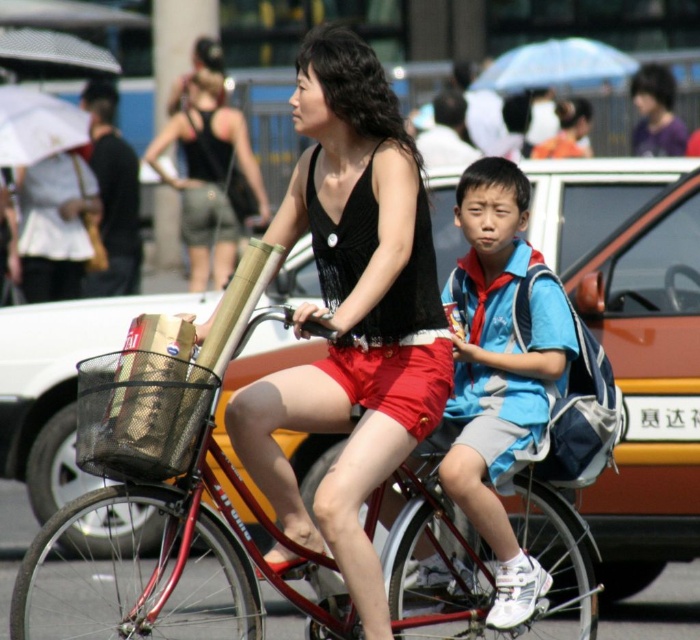
You are a pedestrian walking on the sidewalk and see the black matte tank top at center and the blue fabric backpack at center on the bicycle. Which object is wider?

The black matte tank top at center is wider than the blue fabric backpack at center.

You are a photographer trying to capture a photo of the two points mentioned in the scene. Which point, point (519, 416) or point (172, 244), will appear larger in your photo?

Point (519, 416) is closer to the camera than point (172, 244), so it will appear larger in the photo.

You are a photographer taking a picture of the bicycle and its riders. You notice two points on the bicycle, one at coordinate point (330, 397) and another at point (192, 13). Which point will appear larger in your photo?

Point (330, 397) is closer to the camera than point (192, 13), so it will appear larger in the photo.